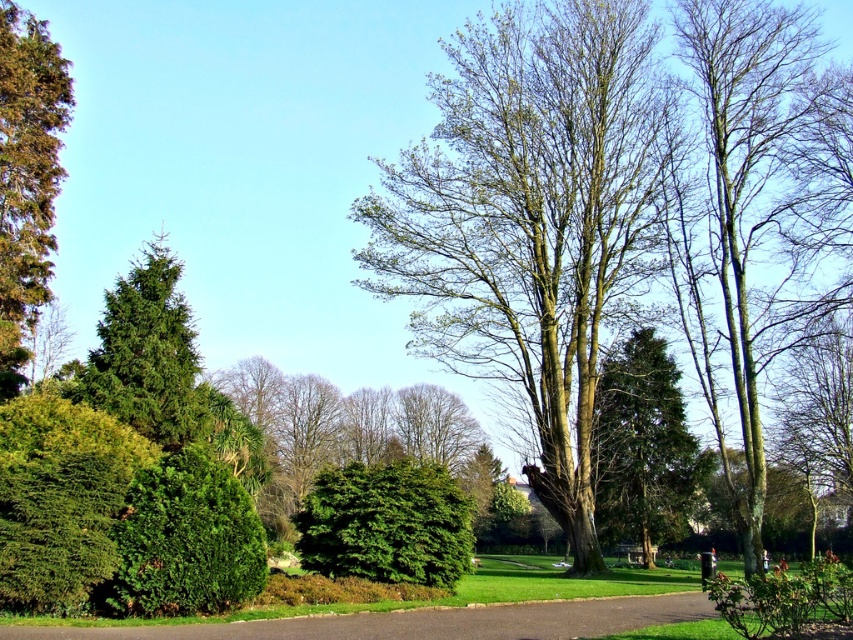
Consider the image. How distant is green textured tree at center from green matte bush at center?

A distance of 29.46 meters exists between green textured tree at center and green matte bush at center.

Is point (654, 465) less distant than point (408, 566)?

No.

I want to click on green textured tree at center, so click(x=643, y=445).

Is green mossy tree at right below brown asphalt path at center?

Actually, green mossy tree at right is above brown asphalt path at center.

Between green mossy tree at right and brown asphalt path at center, which one appears on the left side from the viewer's perspective?

From the viewer's perspective, brown asphalt path at center appears more on the left side.

Where is `green mossy tree at right`? This screenshot has height=640, width=853. green mossy tree at right is located at coordinates (751, 189).

This screenshot has width=853, height=640. What do you see at coordinates (751, 189) in the screenshot?
I see `green mossy tree at right` at bounding box center [751, 189].

Between green mossy tree at right and green matte bush at center, which one appears on the left side from the viewer's perspective?

green matte bush at center is more to the left.

I want to click on green mossy tree at right, so click(x=751, y=189).